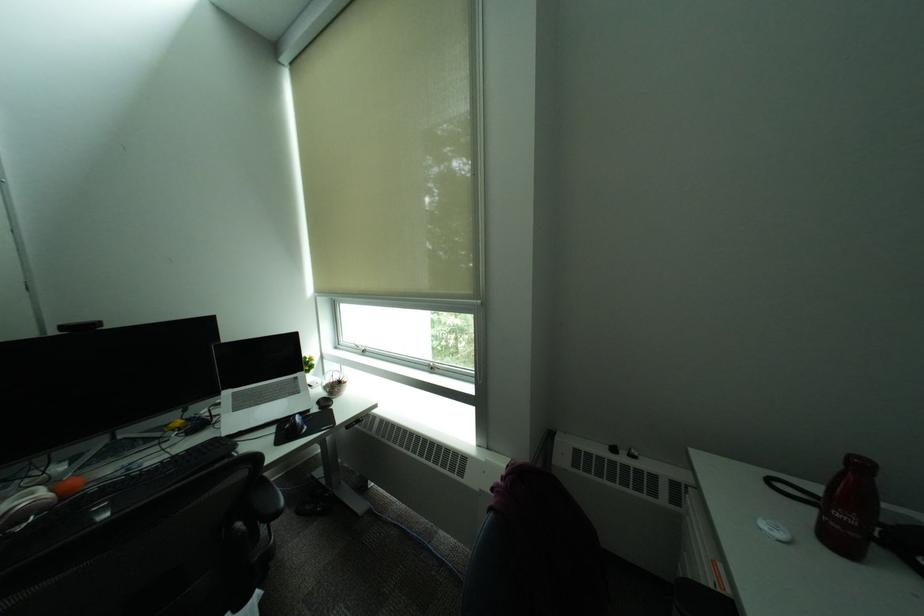
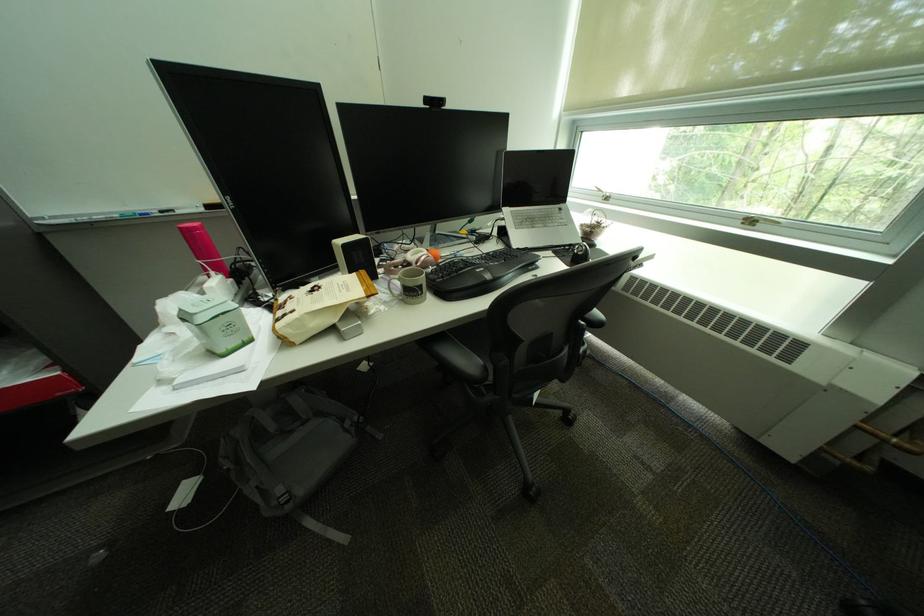
Question: I am providing you with two images of the same scene from different viewpoints. Which of the following objects are not visible in image2?

Choices:
 (A) pink thermos
 (B) grey mug handle
 (C) black computer mouse
 (D) none of these

Answer: (D)